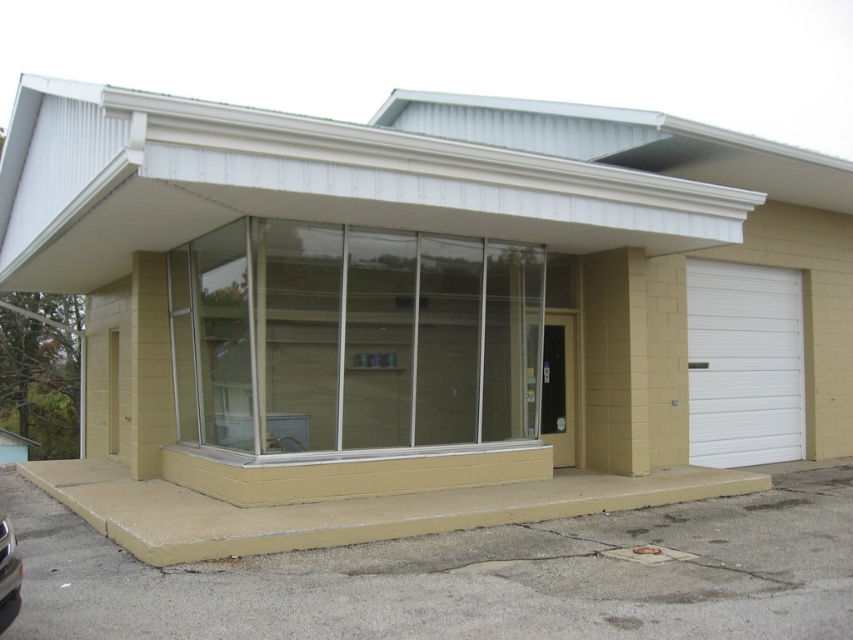
Is transparent glass windows at center to the left of white smooth garage door at right from the viewer's perspective?

Correct, you'll find transparent glass windows at center to the left of white smooth garage door at right.

Which is more to the left, transparent glass windows at center or white smooth garage door at right?

From the viewer's perspective, transparent glass windows at center appears more on the left side.

What do you see at coordinates (352, 339) in the screenshot?
I see `transparent glass windows at center` at bounding box center [352, 339].

Identify the location of transparent glass windows at center. This screenshot has height=640, width=853. (352, 339).

Is white smooth garage door at right taller than shiny silver car at lower left?

Indeed, white smooth garage door at right has a greater height compared to shiny silver car at lower left.

Locate an element on the screen. white smooth garage door at right is located at coordinates (744, 364).

Is point (734, 321) more distant than point (7, 566)?

Yes, point (734, 321) is behind point (7, 566).

Find the location of a particular element. white smooth garage door at right is located at coordinates (744, 364).

Is transparent glass windows at center thinner than shiny silver car at lower left?

Incorrect, transparent glass windows at center's width is not less than shiny silver car at lower left's.

Find the location of a particular element. This screenshot has width=853, height=640. transparent glass windows at center is located at coordinates (352, 339).

Locate an element on the screen. transparent glass windows at center is located at coordinates (352, 339).